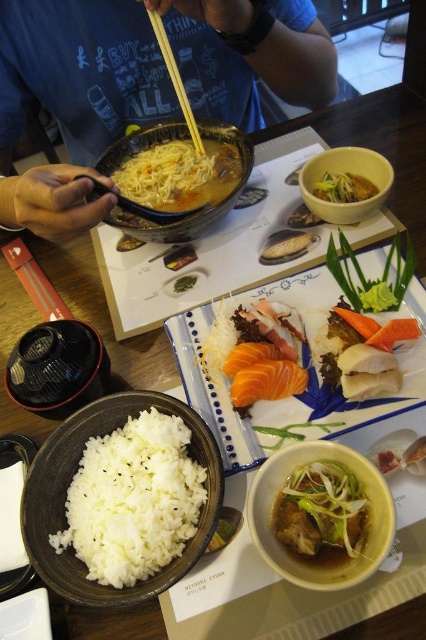
Question: Which point is farther from the camera taking this photo?

Choices:
 (A) (175, 92)
 (B) (117, 225)

Answer: (A)

Question: From the image, what is the correct spatial relationship of shiny green leafy vegetables at center in relation to shiny brown noodles at center?

Choices:
 (A) below
 (B) above

Answer: (A)

Question: Which object appears farthest from the camera in this image?

Choices:
 (A) sashimi platter at center
 (B) pink raw salmon at center
 (C) slightly browned bread at center
 (D) white polished rice at center

Answer: (C)

Question: Can you confirm if shiny brown noodles at center is smaller than slightly browned bread at center?

Choices:
 (A) no
 (B) yes

Answer: (A)

Question: Which object is closer to the camera taking this photo?

Choices:
 (A) white polished rice at center
 (B) matte ceramic bowl at center

Answer: (B)

Question: Can you confirm if sashimi platter at center is wider than white polished rice at center?

Choices:
 (A) yes
 (B) no

Answer: (A)